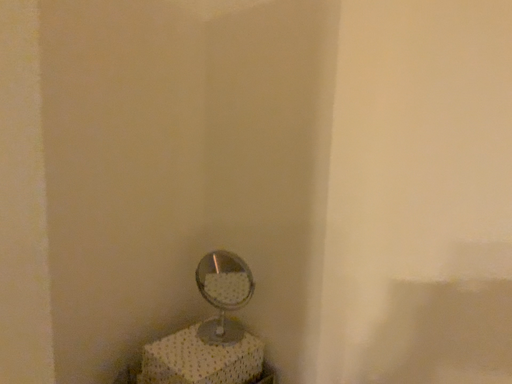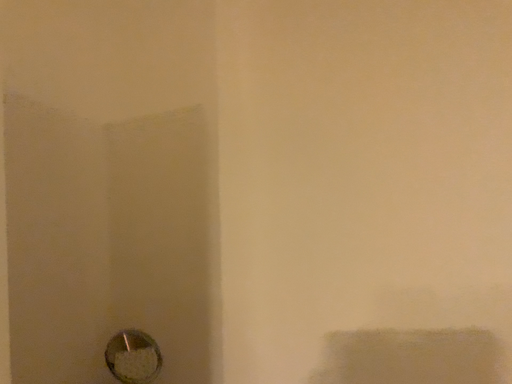
Question: How did the camera likely rotate when shooting the video?

Choices:
 (A) rotated right
 (B) rotated left

Answer: (A)